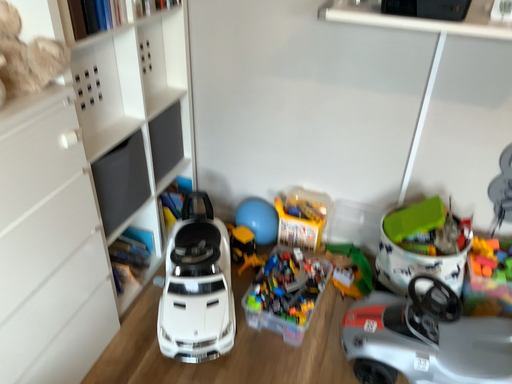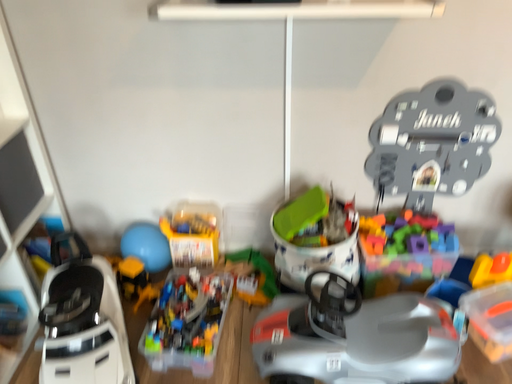
Question: Which way did the camera rotate in the video?

Choices:
 (A) rotated left
 (B) rotated right

Answer: (B)